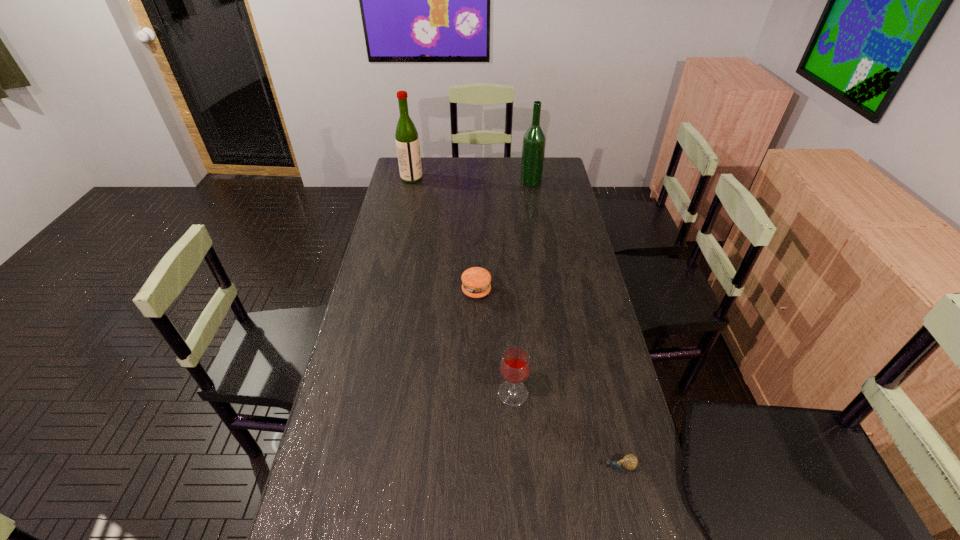
Image resolution: width=960 pixels, height=540 pixels. Find the location of `free space located on the left of the third object from left to right`. free space located on the left of the third object from left to right is located at coordinates (469, 393).

Where is `vacant space located on the left of the third nearest object`? This screenshot has width=960, height=540. vacant space located on the left of the third nearest object is located at coordinates (388, 291).

The image size is (960, 540). Identify the location of blank space located 0.160m on the front-facing side of the shortest object. coord(537,467).

This screenshot has width=960, height=540. What are the coordinates of `free spot located 0.310m on the front-facing side of the shortest object` in the screenshot? It's located at (476, 467).

At what (x,y) coordinates should I click in order to perform the action: click on free space located 0.210m on the front-facing side of the shortest object. Please return your answer as a coordinate pair (x, y). This screenshot has width=960, height=540. Looking at the image, I should click on (516, 467).

Find the location of `liquor that is at the far edge`. liquor that is at the far edge is located at coordinates (407, 141).

The image size is (960, 540). What are the coordinates of `alcohol at the far edge` in the screenshot? It's located at (534, 140).

At what (x,y) coordinates should I click in order to perform the action: click on object present at the left edge. Please return your answer as a coordinate pair (x, y). Looking at the image, I should click on (407, 141).

You are a GUI agent. You are given a task and a screenshot of the screen. Output one action in this format:
    pyautogui.click(x=<x>, y=<y>)
    Task: Click on the alcohol that is positioned at the right edge
    
    Given the screenshot: What is the action you would take?
    pyautogui.click(x=534, y=140)

Image resolution: width=960 pixels, height=540 pixels. I want to click on escargot at the right edge, so coord(629,462).